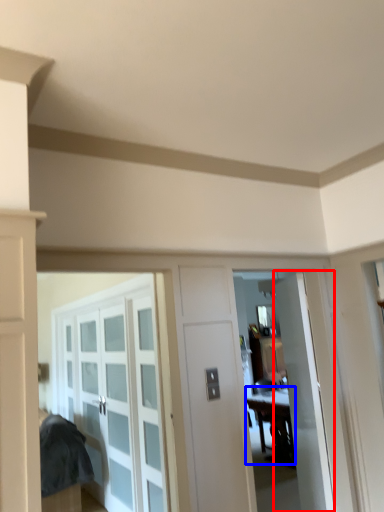
Question: Which of the following is the farthest to the observer, door (highlighted by a red box) or table (highlighted by a blue box)?

Choices:
 (A) door
 (B) table

Answer: (B)